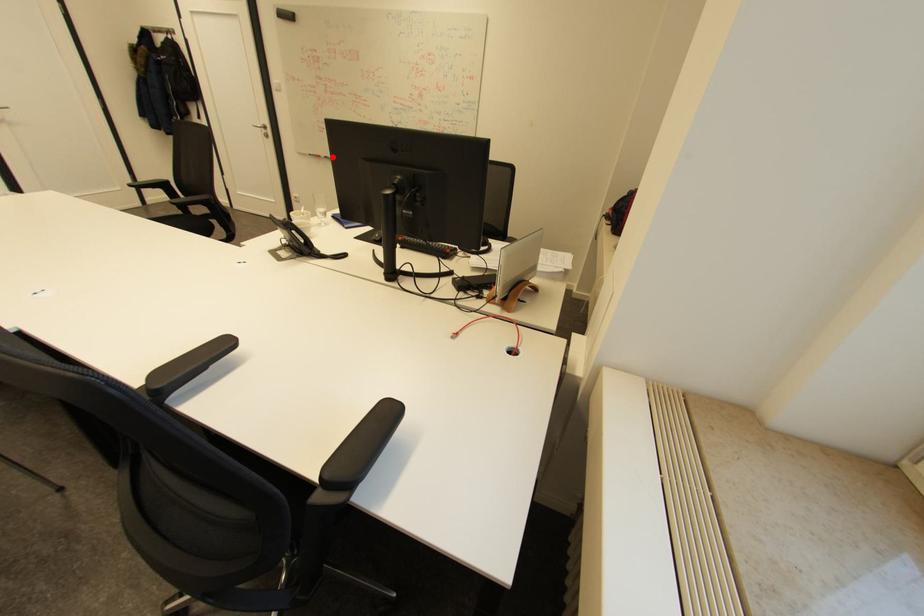
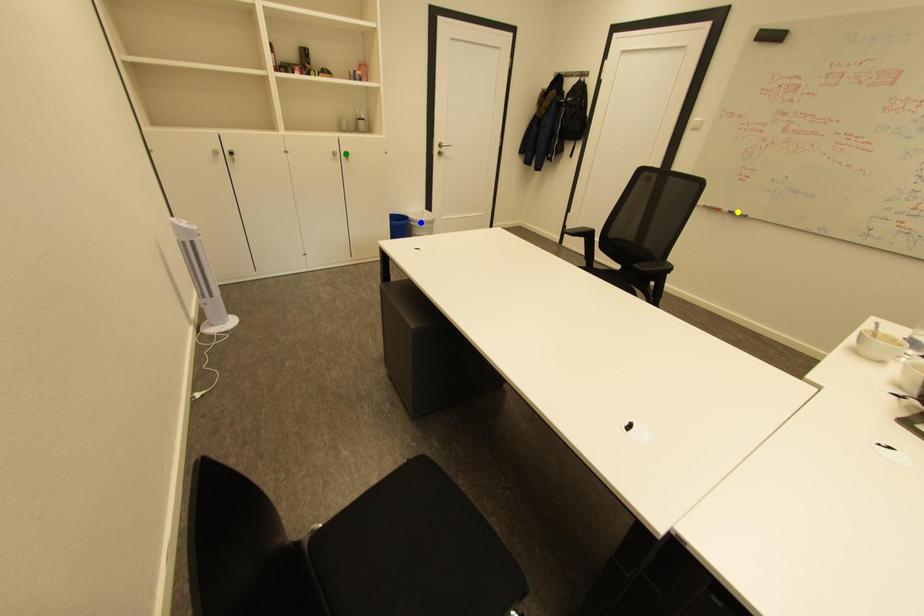
Question: I am providing you with two images of the same scene from different viewpoints. A red point is marked on the first image. You are given multiple points on the second image. Which spot in image 2 lines up with the point in image 1?

Choices:
 (A) yellow point
 (B) blue point
 (C) green point

Answer: (A)